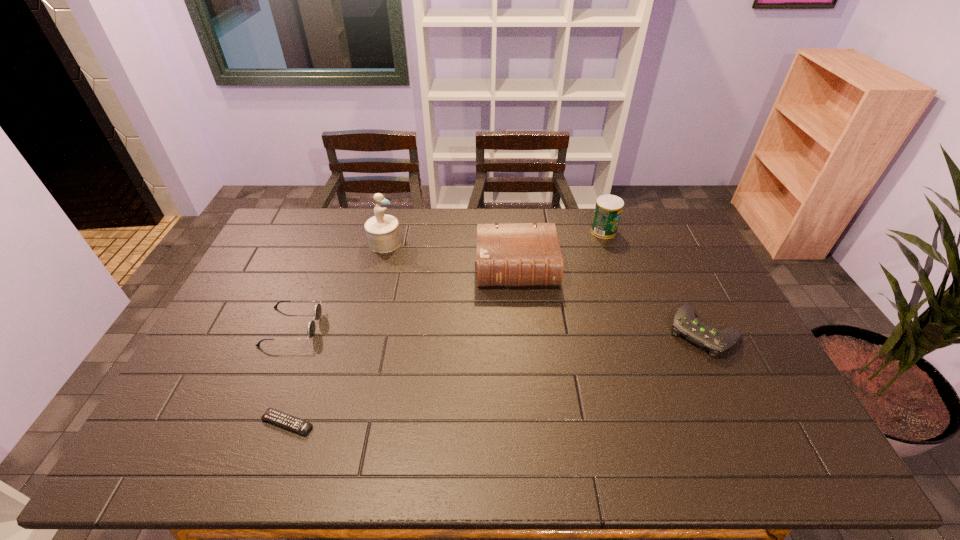
Locate an element on the screen. Image resolution: width=960 pixels, height=540 pixels. free space between the can and the nearest object is located at coordinates (445, 327).

The image size is (960, 540). I want to click on vacant space that's between the nearest object and the sunglasses, so click(x=290, y=375).

The height and width of the screenshot is (540, 960). I want to click on object that stands as the third closest to the figurine, so click(x=272, y=415).

Where is `the fifth closest object relative to the rightmost object`? The image size is (960, 540). the fifth closest object relative to the rightmost object is located at coordinates (x=311, y=327).

Locate an element on the screen. The image size is (960, 540). blank area in the image that satisfies the following two spatial constraints: 1. at the beak of the fourth object from right to left; 2. on the front side of the remote control is located at coordinates (340, 423).

Find the location of a particular element. The width and height of the screenshot is (960, 540). free point that satisfies the following two spatial constraints: 1. on the spine side of the third object from right to left; 2. on the front-facing side of the sunglasses is located at coordinates (522, 327).

Where is `blank space that satisfies the following two spatial constraints: 1. on the front-facing side of the rightmost object; 2. on the left side of the sunglasses`? blank space that satisfies the following two spatial constraints: 1. on the front-facing side of the rightmost object; 2. on the left side of the sunglasses is located at coordinates (290, 332).

The image size is (960, 540). In order to click on vacant space that satisfies the following two spatial constraints: 1. on the front-facing side of the sunglasses; 2. on the back side of the rightmost object in this screenshot , I will do `click(290, 332)`.

What are the coordinates of `vacant space that satisfies the following two spatial constraints: 1. on the front-facing side of the sunglasses; 2. on the left side of the remote control` in the screenshot? It's located at (252, 423).

In order to click on free space in the image that satisfies the following two spatial constraints: 1. on the front-facing side of the nearest object; 2. on the left side of the sunglasses in this screenshot , I will do `click(252, 423)`.